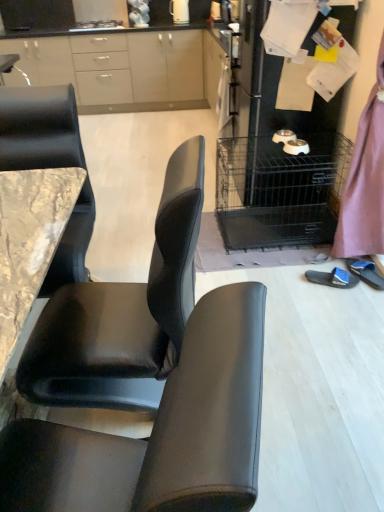
Question: Is blue fabric slipper at lower right, the 2th footwear viewed from the left, with matte white cabinets at upper left?

Choices:
 (A) no
 (B) yes

Answer: (A)

Question: Is matte white cabinets at upper left surrounded by blue fabric slipper at lower right, which is the first footwear from right to left?

Choices:
 (A) yes
 (B) no

Answer: (B)

Question: Is blue fabric slipper at lower right, the 2th footwear viewed from the left, at the left side of matte white cabinets at upper left?

Choices:
 (A) no
 (B) yes

Answer: (A)

Question: Is blue fabric slipper at lower right, the 2th footwear viewed from the left, closer to the viewer compared to matte white cabinets at upper left?

Choices:
 (A) yes
 (B) no

Answer: (A)

Question: Are blue fabric slipper at lower right, which is the first footwear from right to left, and matte white cabinets at upper left located far from each other?

Choices:
 (A) no
 (B) yes

Answer: (B)

Question: Does point (352, 278) appear closer or farther from the camera than point (185, 1)?

Choices:
 (A) farther
 (B) closer

Answer: (B)

Question: From a real-world perspective, is blue fabric slipper at lower right, marked as the 1th footwear in a left-to-right arrangement, physically located above or below white glossy electric kettle at upper center?

Choices:
 (A) above
 (B) below

Answer: (B)

Question: Would you say blue fabric slipper at lower right, arranged as the second footwear when viewed from the right, is to the left or to the right of white glossy electric kettle at upper center in the picture?

Choices:
 (A) right
 (B) left

Answer: (A)

Question: In terms of size, does blue fabric slipper at lower right, marked as the 1th footwear in a left-to-right arrangement, appear bigger or smaller than white glossy electric kettle at upper center?

Choices:
 (A) small
 (B) big

Answer: (A)

Question: Would you say blue fabric slipper at lower right, which is the first footwear from right to left, is to the left or to the right of white glossy electric kettle at upper center in the picture?

Choices:
 (A) right
 (B) left

Answer: (A)

Question: Is point (359, 262) closer or farther from the camera than point (178, 16)?

Choices:
 (A) closer
 (B) farther

Answer: (A)

Question: Would you say blue fabric slipper at lower right, the 2th footwear viewed from the left, is inside or outside white glossy electric kettle at upper center?

Choices:
 (A) outside
 (B) inside

Answer: (A)

Question: From the image's perspective, relative to white glossy electric kettle at upper center, is blue fabric slipper at lower right, the 2th footwear viewed from the left, above or below?

Choices:
 (A) below
 (B) above

Answer: (A)

Question: Is point (360, 266) positioned closer to the camera than point (344, 278)?

Choices:
 (A) farther
 (B) closer

Answer: (A)

Question: Choose the correct answer: Is blue fabric slipper at lower right, which is the first footwear from right to left, inside blue fabric slipper at lower right, arranged as the second footwear when viewed from the right, or outside it?

Choices:
 (A) inside
 (B) outside

Answer: (B)